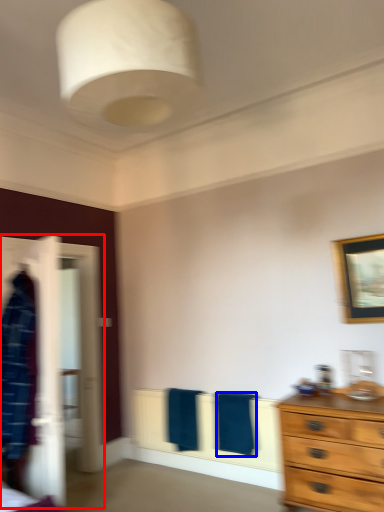
Question: Among these objects, which one is farthest to the camera, closet (highlighted by a red box) or bath towel (highlighted by a blue box)?

Choices:
 (A) closet
 (B) bath towel

Answer: (B)